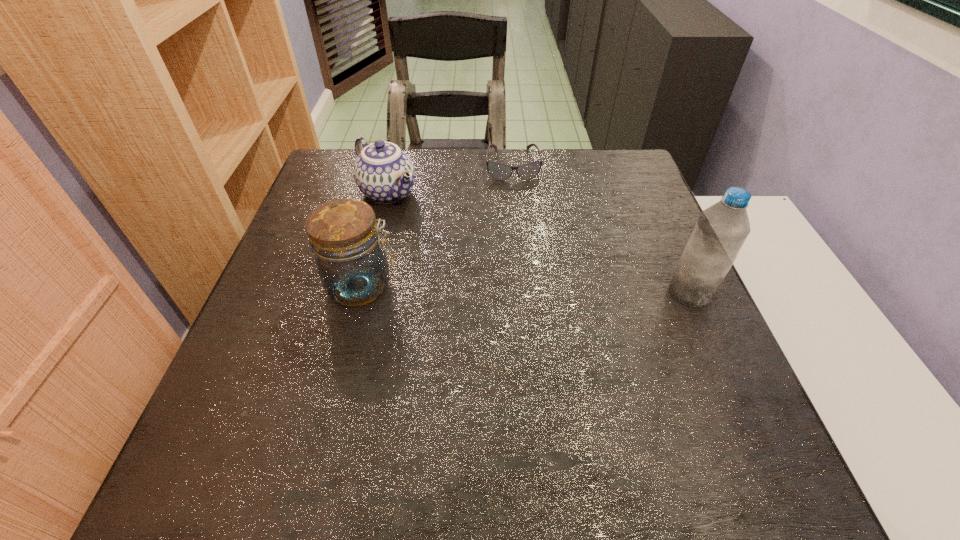
The image size is (960, 540). Find the location of `free spot between the chinaware and the second object from right to left`. free spot between the chinaware and the second object from right to left is located at coordinates (450, 179).

Where is `vacant space that's between the shortest object and the rightmost object`? The image size is (960, 540). vacant space that's between the shortest object and the rightmost object is located at coordinates (601, 229).

This screenshot has width=960, height=540. I want to click on free space that is in between the second shortest object and the shortest object, so click(x=450, y=179).

Identify the location of vacant area that lies between the jar and the sunglasses. (438, 225).

This screenshot has height=540, width=960. What are the coordinates of `free space that is in between the jar and the rightmost object` in the screenshot? It's located at (526, 289).

The height and width of the screenshot is (540, 960). In order to click on object that is the third closest one to the tallest object in this screenshot , I will do `click(383, 172)`.

Where is `the closest object relative to the chinaware`? Image resolution: width=960 pixels, height=540 pixels. the closest object relative to the chinaware is located at coordinates (343, 234).